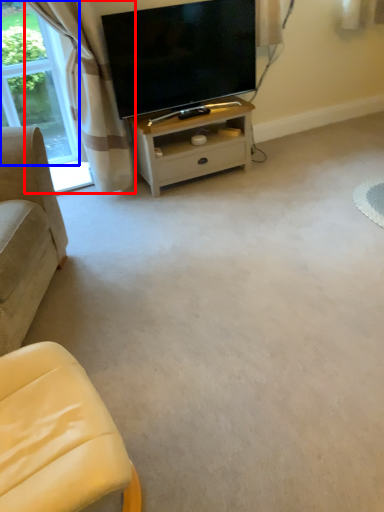
Question: Which point is further to the camera, curtain (highlighted by a red box) or bay window (highlighted by a blue box)?

Choices:
 (A) curtain
 (B) bay window

Answer: (B)